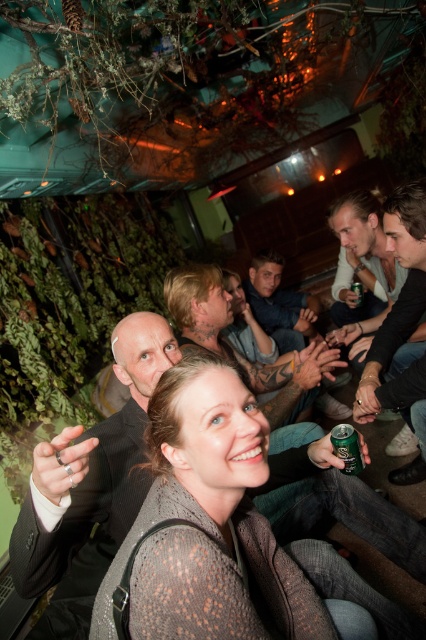
Which is more to the left, smooth black shirt at right or green metallic can at lower right?

Positioned to the left is green metallic can at lower right.

Which of these two, smooth black shirt at right or green metallic can at lower right, stands taller?

smooth black shirt at right is taller.

Which is in front, point (423, 352) or point (360, 456)?

Point (360, 456) is more forward.

Locate an element on the screen. The width and height of the screenshot is (426, 640). smooth black shirt at right is located at coordinates (400, 330).

In the scene shown: Between shiny silver necklace at center and denim shirt at center, which one is positioned higher?

denim shirt at center

I want to click on shiny silver necklace at center, so click(x=238, y=349).

Is point (224, 348) positioned in front of point (310, 301)?

That is True.

Locate an element on the screen. Image resolution: width=426 pixels, height=640 pixels. shiny silver necklace at center is located at coordinates (238, 349).

Does point (241, 320) come closer to viewer compared to point (342, 433)?

No, it is not.

Is smooth skin face at center thinner than green metallic can at lower right?

No.

Where is `smooth skin face at center`? This screenshot has height=640, width=426. smooth skin face at center is located at coordinates (245, 324).